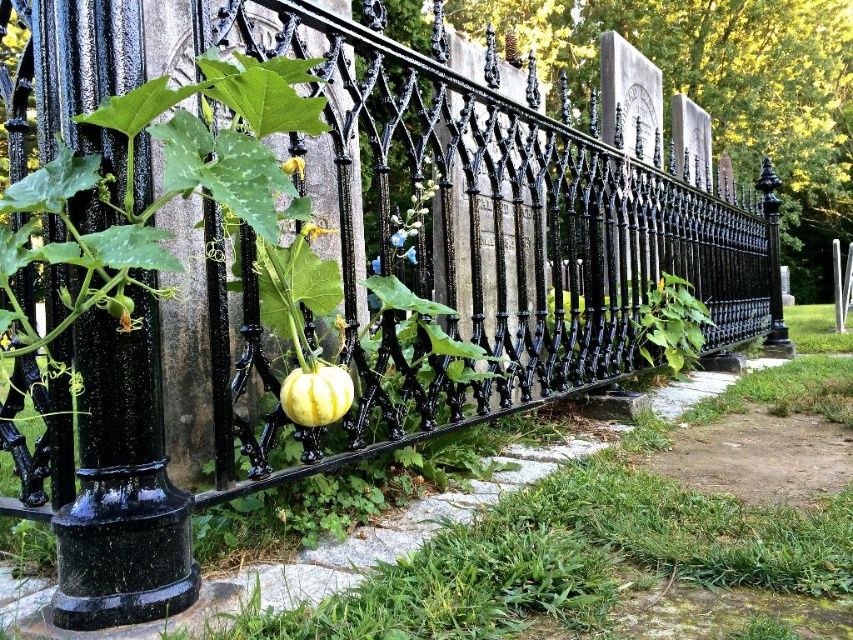
You are a gardener who wants to plant a new flower in the cemetery. You see the yellow striped pumpkin at center and the yellow matte flower at center. Which one is larger in size?

The yellow striped pumpkin at center is bigger than the yellow matte flower at center, so the pumpkin is larger in size.